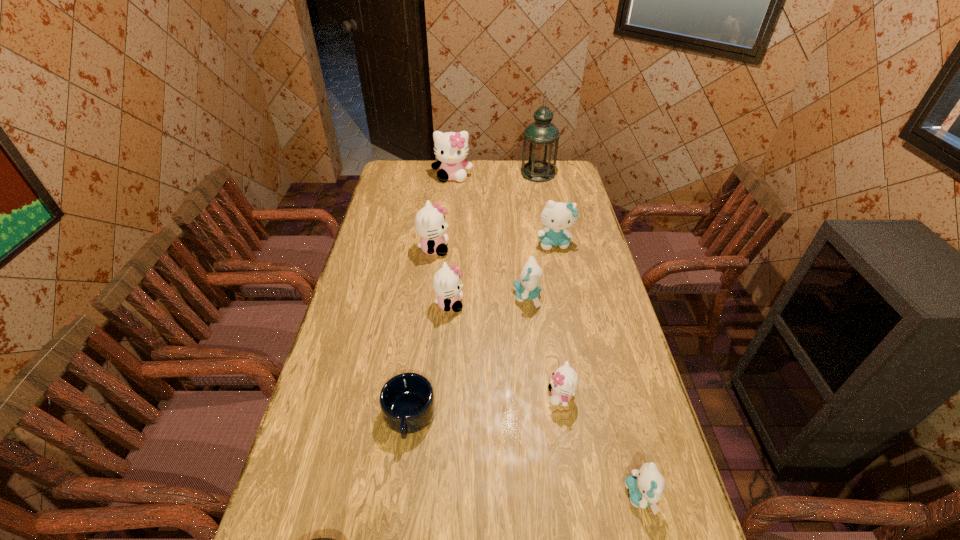
The width and height of the screenshot is (960, 540). Find the location of `white kitten that stands as the second closest to the third smallest white kitten`. white kitten that stands as the second closest to the third smallest white kitten is located at coordinates (451, 148).

Select which blue kitten appears as the second closest to the second nearest white kitten. Please provide its 2D coordinates. Your answer should be formatted as a tuple, i.e. [(x, y)], where the tuple contains the x and y coordinates of a point satisfying the conditions above.

[(557, 216)]

The image size is (960, 540). In order to click on blue kitten that is the closest to the tallest kitten in this screenshot , I will do `click(557, 216)`.

Image resolution: width=960 pixels, height=540 pixels. I want to click on free spot that satisfies the following two spatial constraints: 1. on the face of the farthest blue kitten; 2. on the front-facing side of the second biggest white kitten, so click(556, 249).

Where is `free spot that satisfies the following two spatial constraints: 1. on the face of the leftmost blue kitten; 2. with the handle on the side of the blue mug`? free spot that satisfies the following two spatial constraints: 1. on the face of the leftmost blue kitten; 2. with the handle on the side of the blue mug is located at coordinates point(540,416).